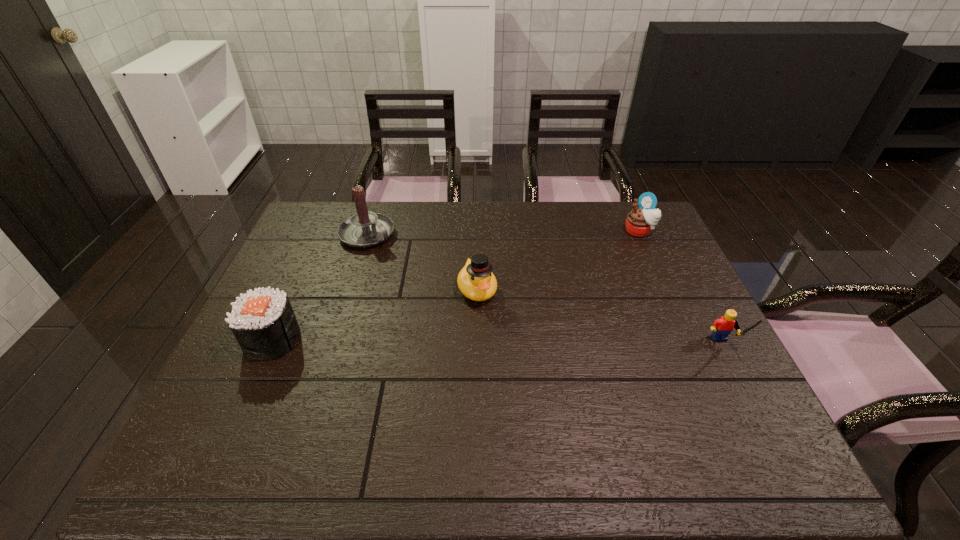
In order to click on candle at the left edge in this screenshot , I will do `click(364, 229)`.

Find the location of a particular element. The width and height of the screenshot is (960, 540). Lego at the right edge is located at coordinates (722, 327).

Find the location of a particular element. muffin positioned at the right edge is located at coordinates (640, 221).

At what (x,y) coordinates should I click in order to perform the action: click on object present at the far left corner. Please return your answer as a coordinate pair (x, y). Looking at the image, I should click on (364, 229).

Identify the location of object located in the far right corner section of the desktop. (640, 221).

Image resolution: width=960 pixels, height=540 pixels. In the image, there is a desktop. Identify the location of vacant region at the far edge. (468, 202).

This screenshot has height=540, width=960. Identify the location of vacant space at the near edge. (415, 421).

In the image, there is a desktop. In order to click on free space at the right edge in this screenshot , I will do `click(678, 299)`.

Identify the location of vacant space at the far left corner of the desktop. (335, 216).

Where is `vacant space at the near left corner of the desktop`? vacant space at the near left corner of the desktop is located at coordinates (201, 419).